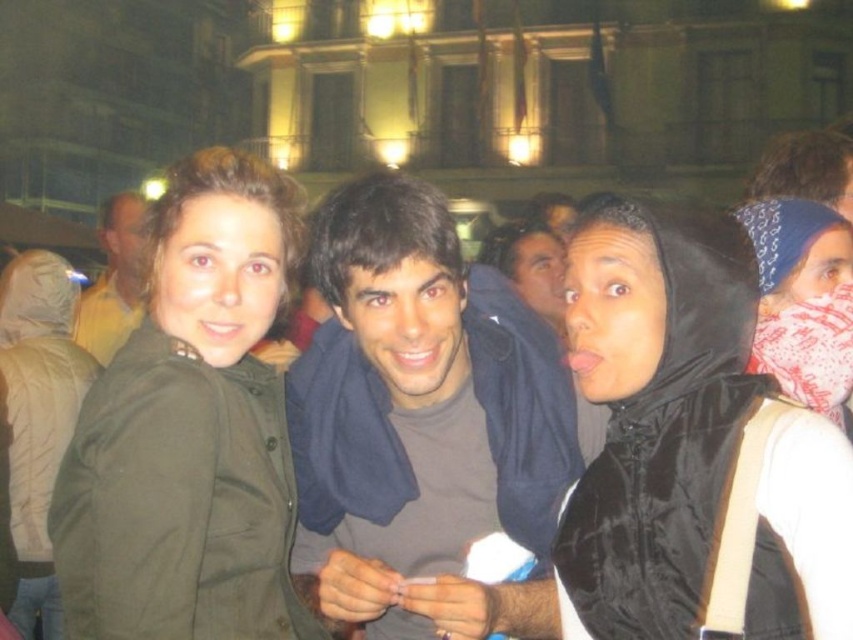
Question: Is white fabric headscarf at upper right further to camera compared to matte black jacket at center?

Choices:
 (A) yes
 (B) no

Answer: (B)

Question: Which point is closer to the camera taking this photo?

Choices:
 (A) (515, 269)
 (B) (466, 436)

Answer: (B)

Question: Based on their relative distances, which object is nearer to the black matte jacket at center?

Choices:
 (A) matte black jacket at center
 (B) white fabric headscarf at upper right
 (C) smooth brown shirt at center
 (D) matte olive green jacket at center

Answer: (C)

Question: Among these points, which one is farthest from the camera?

Choices:
 (A) (115, 364)
 (B) (463, 378)
 (C) (560, 294)

Answer: (C)

Question: Can you confirm if green matte jacket at center is positioned below white fabric headscarf at upper right?

Choices:
 (A) no
 (B) yes

Answer: (B)

Question: Does matte olive green jacket at center have a greater width compared to white fabric headscarf at upper right?

Choices:
 (A) no
 (B) yes

Answer: (B)